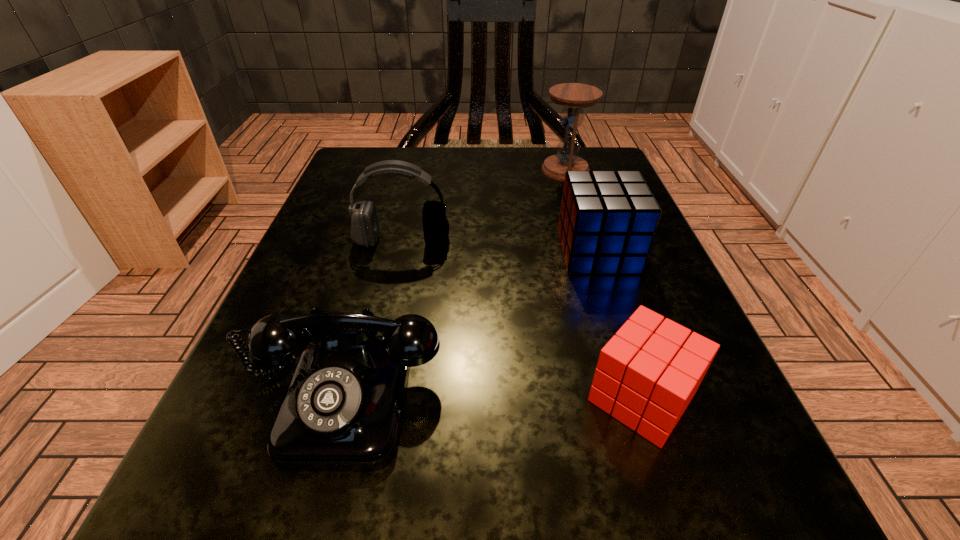
Identify the location of hourglass. This screenshot has height=540, width=960. (574, 97).

Locate an element on the screen. The image size is (960, 540). headset is located at coordinates (364, 223).

Locate an element on the screen. The height and width of the screenshot is (540, 960). the taller cube is located at coordinates (607, 222).

Locate an element on the screen. telephone is located at coordinates (342, 411).

What are the coordinates of `the shorter cube` in the screenshot? It's located at (647, 374).

Locate an element on the screen. the shortest object is located at coordinates (647, 374).

You are a GUI agent. You are given a task and a screenshot of the screen. Output one action in this format:
    pyautogui.click(x=<x>, y=<y>)
    Task: Click on the vacant region located on the front of the farthest object
    This screenshot has height=540, width=960.
    Given the screenshot: What is the action you would take?
    pyautogui.click(x=605, y=299)

What are the coordinates of `vacant space located 0.210m on the headband of the headset` in the screenshot? It's located at (378, 349).

Image resolution: width=960 pixels, height=540 pixels. Identify the location of vacant space situated on the back of the taller cube. (586, 215).

The image size is (960, 540). Identify the location of free space located 0.060m on the dial of the telephone. click(x=302, y=537).